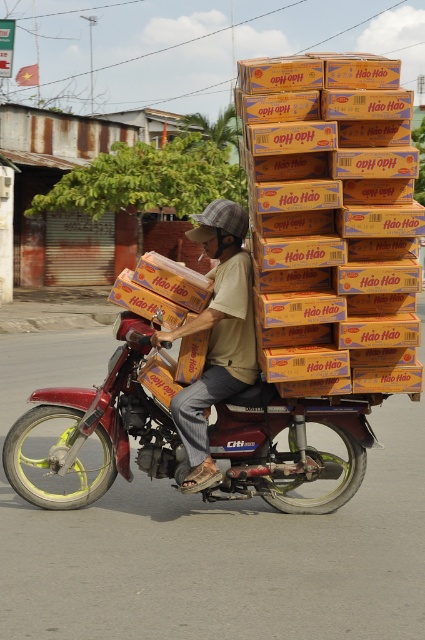
Does metallic red motorcycle at center appear over brown cotton shirt at center?

No.

Does point (141, 413) lie in front of point (170, 410)?

No, (141, 413) is behind (170, 410).

Is point (234, 460) positioned before point (248, 220)?

Yes, it is in front of point (248, 220).

Where is `metallic red motorcycle at center`? The width and height of the screenshot is (425, 640). metallic red motorcycle at center is located at coordinates (99, 428).